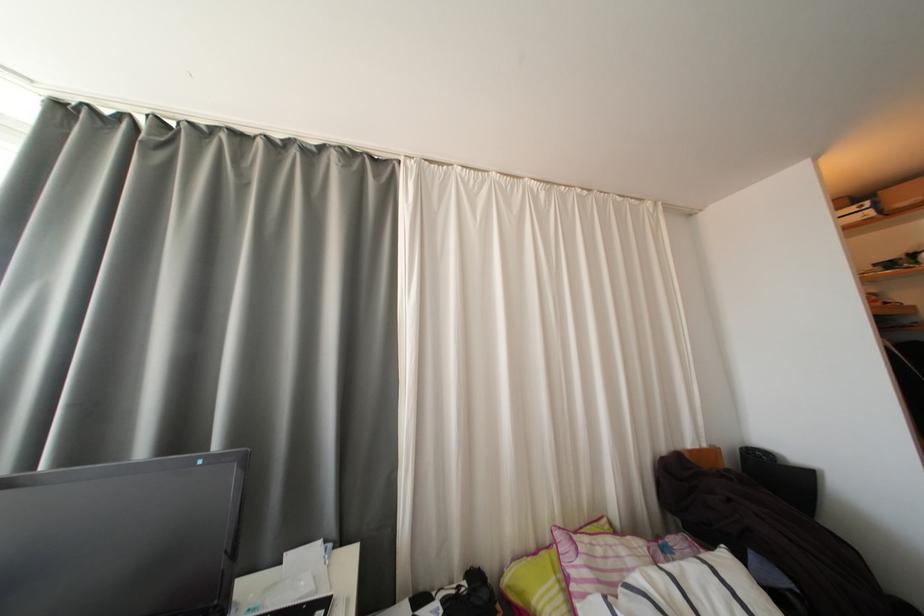
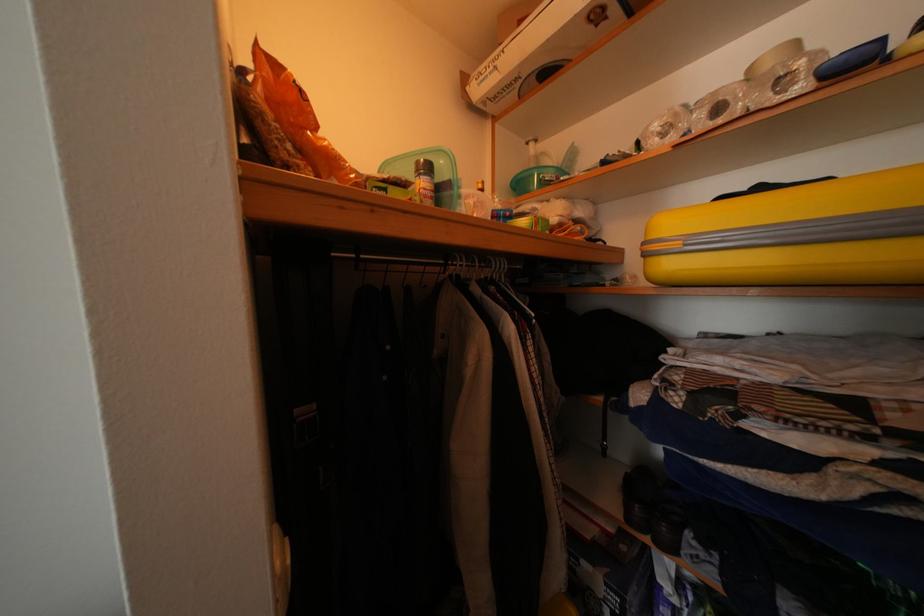
Based on the photo, in a continuous first-person perspective shot, in which direction is the camera moving?

The movement direction of the cameraman is right, forward.